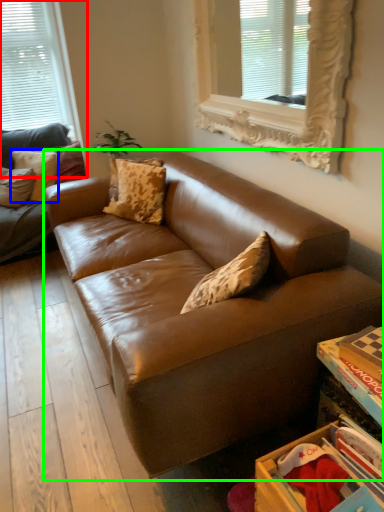
Question: Which object is the closest to the window (highlighted by a red box)? Choose among these: pillow (highlighted by a blue box) or studio couch (highlighted by a green box).

Choices:
 (A) pillow
 (B) studio couch

Answer: (A)